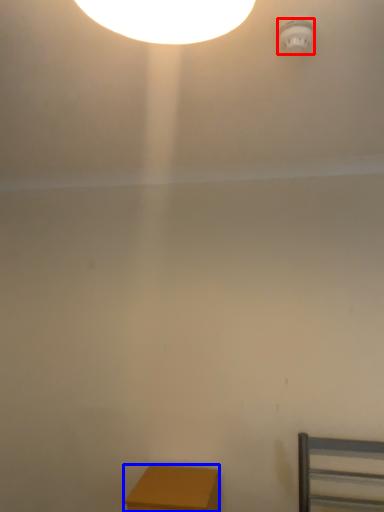
Question: Which point is closer to the camera, lamp (highlighted by a red box) or furniture (highlighted by a blue box)?

Choices:
 (A) lamp
 (B) furniture

Answer: (A)